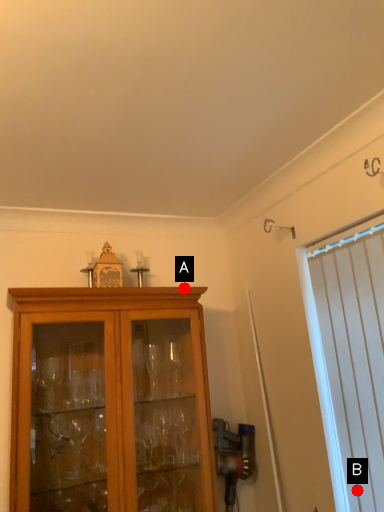
Question: Two points are circled on the image, labeled by A and B beside each circle. Which point is closer to the camera?

Choices:
 (A) A is closer
 (B) B is closer

Answer: (B)